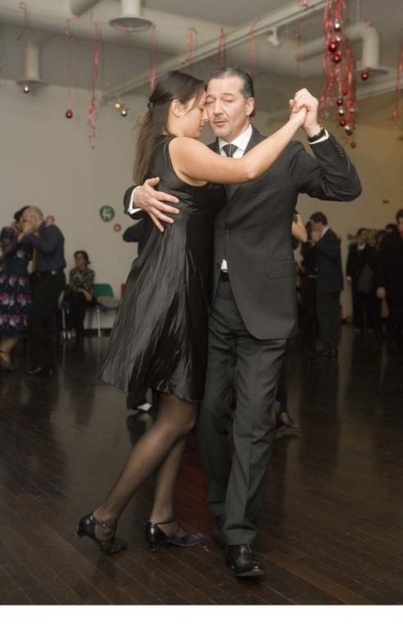
You are a photographer at the event and want to capture a closeup of the black satin dress at center. The camera you are using has a limited field of view. Can you estimate whether the entire black satin dress at center will fit within the camera frame if you focus on point (170, 296)?

The black satin dress at center is located exactly at point (170, 296), so focusing the camera there should center the dress in the frame. However, without knowing the dress dimensions or the camera field of view, it is impossible to confirm if the entire dress will fit within the frame.

You are a photographer at the event and want to ensure both the dark gray suit at center and the dark gray suit at right are clearly visible in your photo. Which suit should you focus on first to ensure it doesn t get cropped out of the frame?

The dark gray suit at center is larger in size than the dark gray suit at right, so focusing on the larger one at center first will ensure it stays within the frame while adjusting for the smaller one at right.